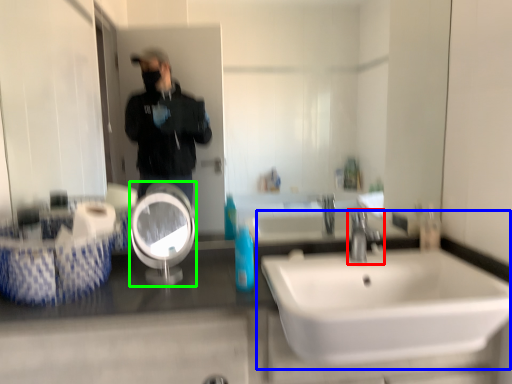
Question: Based on their relative distances, which object is farther from tap (highlighted by a red box)? Choose from sink (highlighted by a blue box) and reflection (highlighted by a green box).

Choices:
 (A) sink
 (B) reflection

Answer: (B)